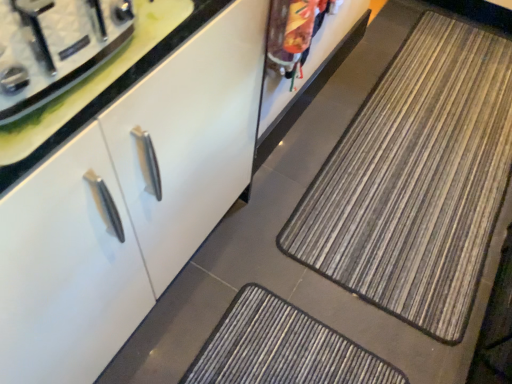
Question: Does brushed metal stove top at upper left have a greater width compared to striped fabric mat at center?

Choices:
 (A) yes
 (B) no

Answer: (B)

Question: Is the position of brushed metal stove top at upper left more distant than that of striped fabric mat at center?

Choices:
 (A) yes
 (B) no

Answer: (B)

Question: Is brushed metal stove top at upper left located outside striped fabric mat at center?

Choices:
 (A) no
 (B) yes

Answer: (B)

Question: Is brushed metal stove top at upper left facing away from striped fabric mat at center?

Choices:
 (A) yes
 (B) no

Answer: (B)

Question: From a real-world perspective, is brushed metal stove top at upper left beneath striped fabric mat at center?

Choices:
 (A) yes
 (B) no

Answer: (B)

Question: Is striped fabric mat at center taller or shorter than brushed metal stove top at upper left?

Choices:
 (A) tall
 (B) short

Answer: (B)

Question: Considering the positions of point (349, 132) and point (14, 59), is point (349, 132) closer or farther from the camera than point (14, 59)?

Choices:
 (A) closer
 (B) farther

Answer: (B)

Question: Based on their sizes in the image, would you say striped fabric mat at center is bigger or smaller than brushed metal stove top at upper left?

Choices:
 (A) small
 (B) big

Answer: (B)

Question: Which is correct: striped fabric mat at center is inside brushed metal stove top at upper left, or outside of it?

Choices:
 (A) inside
 (B) outside

Answer: (B)

Question: Considering the positions of white glossy cabinet at center and brushed metal stove top at upper left in the image, is white glossy cabinet at center taller or shorter than brushed metal stove top at upper left?

Choices:
 (A) tall
 (B) short

Answer: (A)

Question: Is white glossy cabinet at center in front of or behind brushed metal stove top at upper left in the image?

Choices:
 (A) front
 (B) behind

Answer: (A)

Question: In terms of size, does white glossy cabinet at center appear bigger or smaller than brushed metal stove top at upper left?

Choices:
 (A) big
 (B) small

Answer: (A)

Question: Considering the positions of white glossy cabinet at center and brushed metal stove top at upper left in the image, is white glossy cabinet at center wider or thinner than brushed metal stove top at upper left?

Choices:
 (A) thin
 (B) wide

Answer: (B)

Question: From a real-world perspective, is white glossy cabinet at center physically located above or below striped fabric mat at center?

Choices:
 (A) above
 (B) below

Answer: (A)

Question: Looking at the image, does white glossy cabinet at center seem bigger or smaller compared to striped fabric mat at center?

Choices:
 (A) big
 (B) small

Answer: (A)